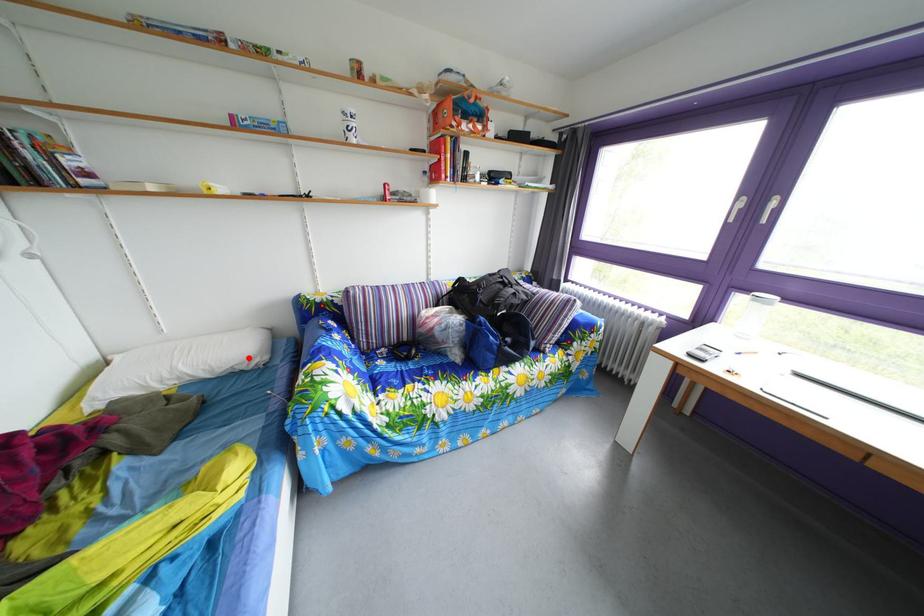
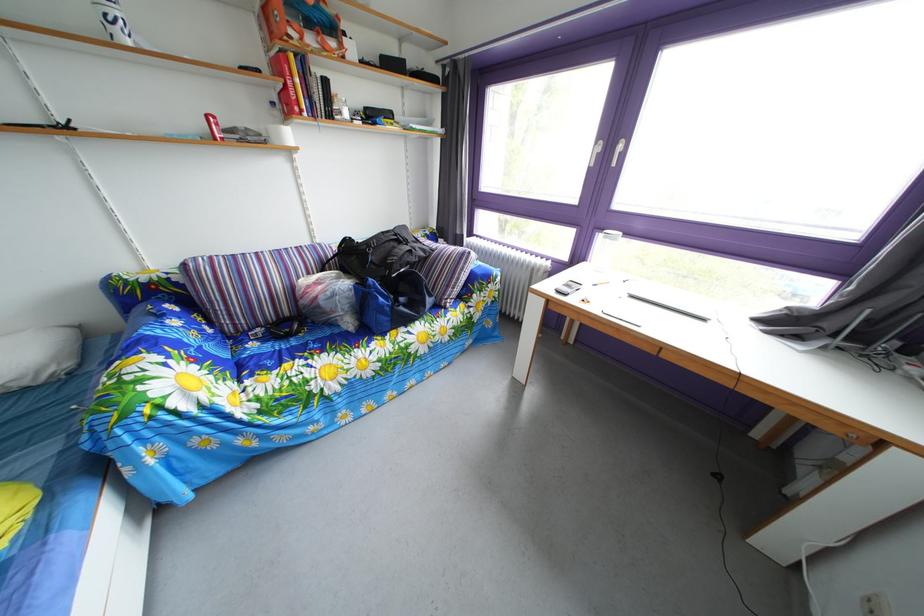
Where in the second image is the point corresponding to the highlighted location from the first image?

(18, 370)